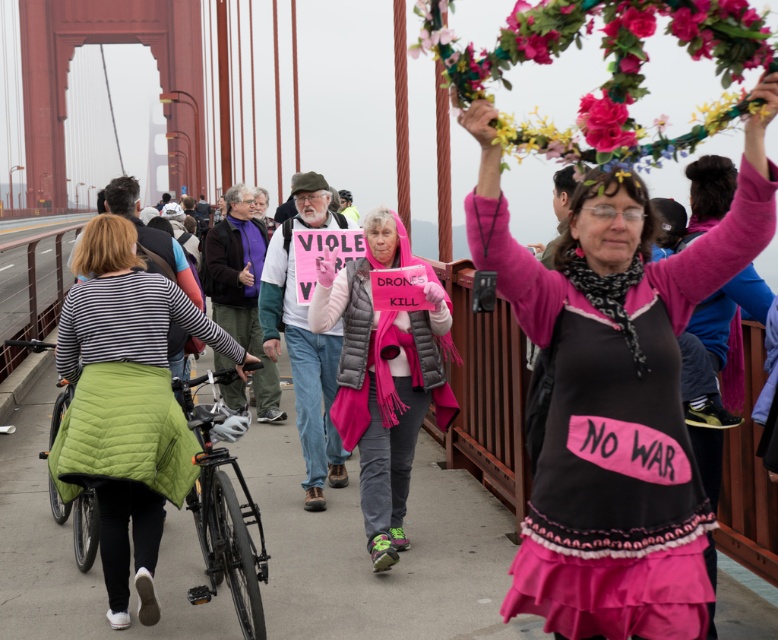
Question: Among these objects, which one is nearest to the camera?

Choices:
 (A) pink fabric shirt at center
 (B) floral garland at upper center

Answer: (A)

Question: Can you confirm if pink fabric shirt at center is positioned to the right of green quilted jacket at left?

Choices:
 (A) yes
 (B) no

Answer: (A)

Question: Which object is the closest to the floral garland at upper center?

Choices:
 (A) pink fabric flower at upper center
 (B) pink fabric shirt at center
 (C) pink quilted vest at center
 (D) green quilted jacket at left

Answer: (B)

Question: Does pink fabric shirt at center have a larger size compared to pink quilted vest at center?

Choices:
 (A) yes
 (B) no

Answer: (B)

Question: Is pink fabric shirt at center smaller than pink fabric flower at upper center?

Choices:
 (A) no
 (B) yes

Answer: (A)

Question: Which of the following is the closest to the observer?

Choices:
 (A) (177, 484)
 (B) (626, 532)

Answer: (B)